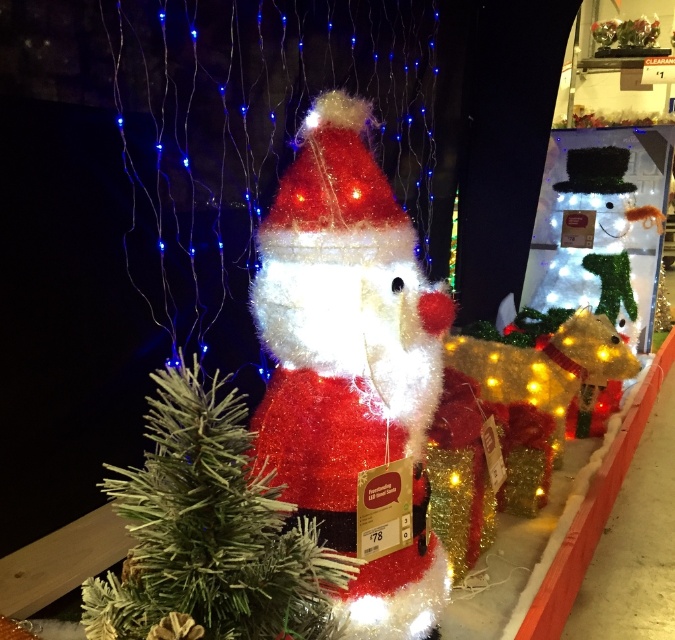
Is point (408, 316) less distant than point (162, 582)?

No.

Between fuzzy tinsel santa at center and frosted tinsel santa at center, which one has more height?

Standing taller between the two is fuzzy tinsel santa at center.

Image resolution: width=675 pixels, height=640 pixels. Describe the element at coordinates (350, 360) in the screenshot. I see `fuzzy tinsel santa at center` at that location.

Find the location of a particular element. fuzzy tinsel santa at center is located at coordinates (350, 360).